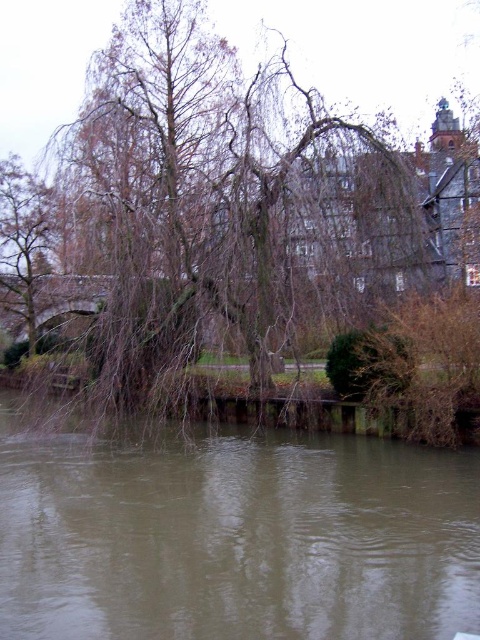
What do you see at coordinates (231, 534) in the screenshot? This screenshot has height=640, width=480. I see `brown murky water at lower center` at bounding box center [231, 534].

Is brown murky water at lower center below brown textured tree at left?

Indeed, brown murky water at lower center is positioned under brown textured tree at left.

Identify the location of brown murky water at lower center. Image resolution: width=480 pixels, height=640 pixels. (231, 534).

Identify the location of brown murky water at lower center. This screenshot has height=640, width=480. (231, 534).

How far apart are brown textured tree at upper left and brown textured tree at left?

brown textured tree at upper left is 9.29 meters away from brown textured tree at left.

Based on the photo, between brown textured tree at upper left and brown textured tree at left, which one has more height?

brown textured tree at upper left is taller.

Locate an element on the screen. brown textured tree at upper left is located at coordinates (226, 205).

Which of these two, brown textured tree at upper left or brown murky water at lower center, stands taller?

brown textured tree at upper left

Who is more forward, (350, 211) or (116, 474)?

Point (116, 474) is more forward.

Image resolution: width=480 pixels, height=640 pixels. Describe the element at coordinates (226, 205) in the screenshot. I see `brown textured tree at upper left` at that location.

The width and height of the screenshot is (480, 640). Identify the location of brown textured tree at upper left. (226, 205).